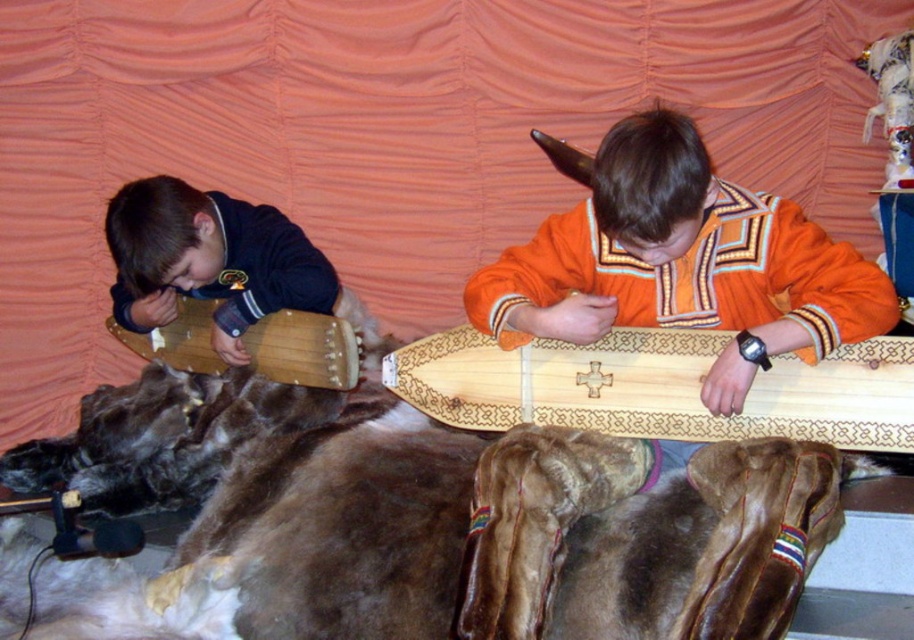
You are a visitor in this room and want to hang a picture frame that is 1.2 meters tall on the wall. The frame needs to be placed above an object that is shorter than it. Which object between the natural wood longboard at center and the wooden drum at left should you choose?

The wooden drum at left is shorter than the natural wood longboard at center. Therefore, the picture frame should be placed above the wooden drum at left since it is shorter than the frame.